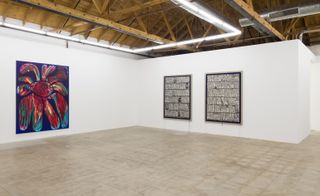
Where is `nails on the ceiling`? This screenshot has width=320, height=196. nails on the ceiling is located at coordinates (37, 4), (54, 4), (69, 12), (82, 12), (97, 17), (110, 20).